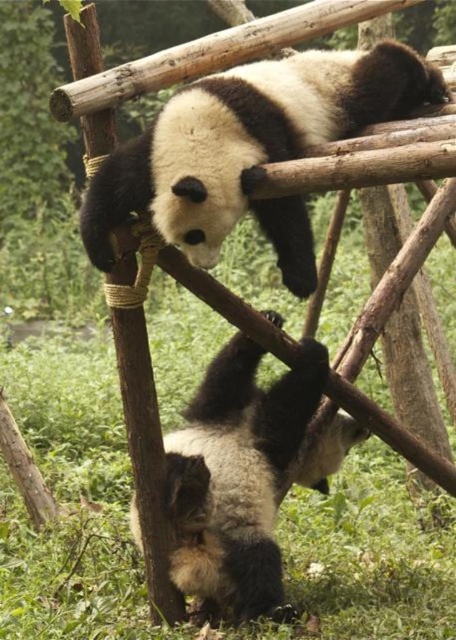
You are a zookeeper observing the pandas. You need to place a treat between them so both can reach it easily. Where should you place the treat relative to the black fuzzy panda at upper center and the soft fur panda at lower center?

The treat should be placed between the black fuzzy panda at upper center and the soft fur panda at lower center, closer to the right side of the black fuzzy panda at upper center since it is positioned to the right of the soft fur panda at lower center.

You are a zookeeper planning to place a treat between the two points, point (161, 204) and point (267, 428). Given that the treat has a width of 0.15 units, will it fit between them without overlapping?

The distance between point (161, 204) and point (267, 428) is not provided, so we cannot determine if the treat will fit. However, since the question mentions their positions in coordinates, we can calculate the distance using the distance formula. The distance is sqrt?0.670?0.319?2? ?0.586?0.355?2? ? which equals sqrt?0.351 squared plus 0.231 squared? ? approximately sqrt?0.123?0.053? ? sqrt?0.176? ? approximately 0.42 units. Since the treat is 0.15 units wide, it will fit between them as 0.15 is less

Based on the scene description, where is the black fuzzy panda at upper center located in terms of its 2D coordinates?

The black fuzzy panda at upper center is located at the 2D coordinates of point [249,148].